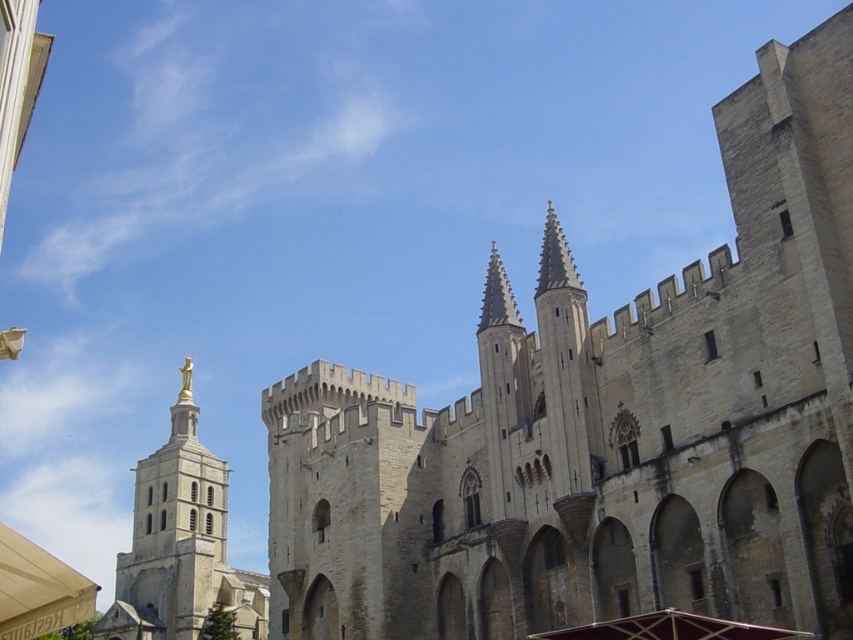
Question: Can you confirm if beige stone castle at center is thinner than gold statue at center?

Choices:
 (A) yes
 (B) no

Answer: (B)

Question: Is beige stone castle at center to the left of gold statue at center from the viewer's perspective?

Choices:
 (A) no
 (B) yes

Answer: (A)

Question: Is beige stone castle at center positioned before gold statue at center?

Choices:
 (A) yes
 (B) no

Answer: (A)

Question: Which object appears closest to the camera in this image?

Choices:
 (A) gold statue at center
 (B) beige stone castle at center

Answer: (B)